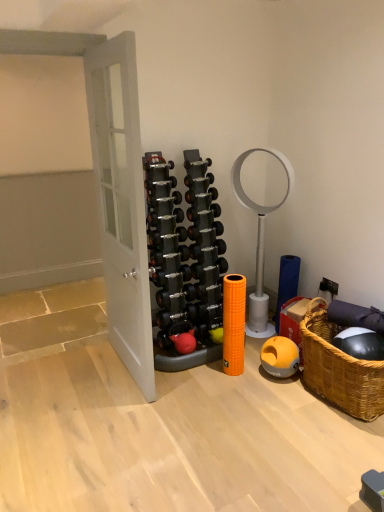
Question: Is black rubber dumbbell at center, which is the fourteenth dumbbell in top-to-bottom order, turned away from black rubber dumbbell at center, the sixteenth dumbbell positioned from the bottom?

Choices:
 (A) no
 (B) yes

Answer: (A)

Question: Does black rubber dumbbell at center, which is the fourteenth dumbbell in top-to-bottom order, have a greater width compared to black rubber dumbbell at center, placed as the first dumbbell when sorted from top to bottom?

Choices:
 (A) no
 (B) yes

Answer: (B)

Question: Is the position of black rubber dumbbell at center, which is the fourteenth dumbbell in top-to-bottom order, more distant than that of black rubber dumbbell at center, the sixteenth dumbbell positioned from the bottom?

Choices:
 (A) no
 (B) yes

Answer: (A)

Question: Considering the relative sizes of black rubber dumbbell at center, which is the fourteenth dumbbell in top-to-bottom order, and black rubber dumbbell at center, placed as the first dumbbell when sorted from top to bottom, in the image provided, is black rubber dumbbell at center, which is the fourteenth dumbbell in top-to-bottom order, shorter than black rubber dumbbell at center, placed as the first dumbbell when sorted from top to bottom,?

Choices:
 (A) no
 (B) yes

Answer: (A)

Question: Is black rubber dumbbell at center, the 3th dumbbell when ordered from bottom to top, at the left side of black rubber dumbbell at center, placed as the first dumbbell when sorted from top to bottom?

Choices:
 (A) no
 (B) yes

Answer: (B)

Question: From a real-world perspective, is black rubber dumbbell at center, which is the fourteenth dumbbell in top-to-bottom order, beneath black rubber dumbbell at center, placed as the first dumbbell when sorted from top to bottom?

Choices:
 (A) no
 (B) yes

Answer: (B)

Question: Does black rubber dumbbell at center, the sixteenth dumbbell positioned from the bottom, lie behind black rubber dumbbell at center, which ranks as the sixth dumbbell in bottom-to-top order?

Choices:
 (A) yes
 (B) no

Answer: (A)

Question: Is black rubber dumbbell at center, placed as the first dumbbell when sorted from top to bottom, outside black rubber dumbbell at center, positioned as the eleventh dumbbell in top-to-bottom order?

Choices:
 (A) no
 (B) yes

Answer: (B)

Question: Considering the relative sizes of black rubber dumbbell at center, placed as the first dumbbell when sorted from top to bottom, and black rubber dumbbell at center, positioned as the eleventh dumbbell in top-to-bottom order, in the image provided, is black rubber dumbbell at center, placed as the first dumbbell when sorted from top to bottom, wider than black rubber dumbbell at center, positioned as the eleventh dumbbell in top-to-bottom order,?

Choices:
 (A) no
 (B) yes

Answer: (A)

Question: From the image's perspective, is black rubber dumbbell at center, placed as the first dumbbell when sorted from top to bottom, on black rubber dumbbell at center, which ranks as the sixth dumbbell in bottom-to-top order?

Choices:
 (A) no
 (B) yes

Answer: (B)

Question: Considering the relative sizes of black rubber dumbbell at center, the sixteenth dumbbell positioned from the bottom, and black rubber dumbbell at center, positioned as the eleventh dumbbell in top-to-bottom order, in the image provided, is black rubber dumbbell at center, the sixteenth dumbbell positioned from the bottom, shorter than black rubber dumbbell at center, positioned as the eleventh dumbbell in top-to-bottom order,?

Choices:
 (A) no
 (B) yes

Answer: (B)

Question: Does black rubber dumbbell at center, placed as the first dumbbell when sorted from top to bottom, turn towards black rubber dumbbell at center, which ranks as the sixth dumbbell in bottom-to-top order?

Choices:
 (A) yes
 (B) no

Answer: (B)

Question: Does black rubber dumbbell at center, arranged as the 9th dumbbell when ordered from the bottom, have a larger size compared to silver metallic dumbbell at center, which is the 14th dumbbell in bottom-to-top order?

Choices:
 (A) no
 (B) yes

Answer: (B)